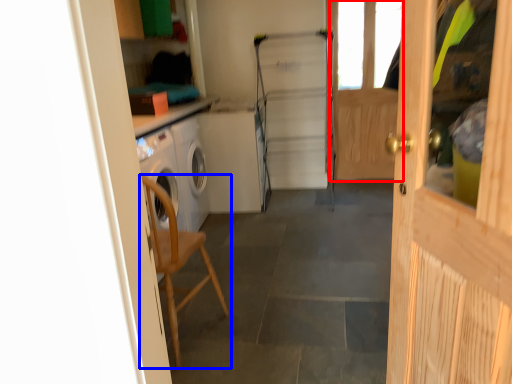
Question: Which of the following is the farthest to the observer, screen door (highlighted by a red box) or chair (highlighted by a blue box)?

Choices:
 (A) screen door
 (B) chair

Answer: (A)